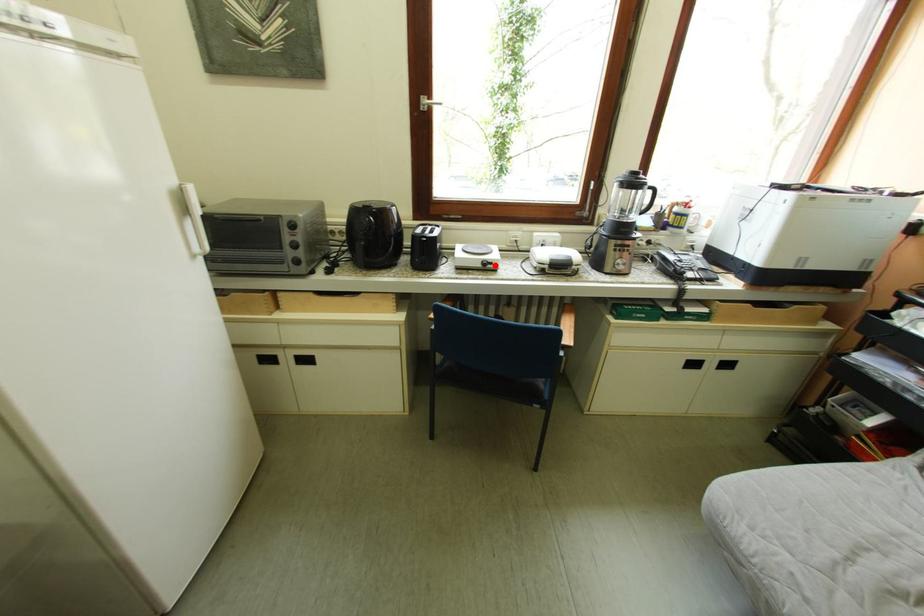
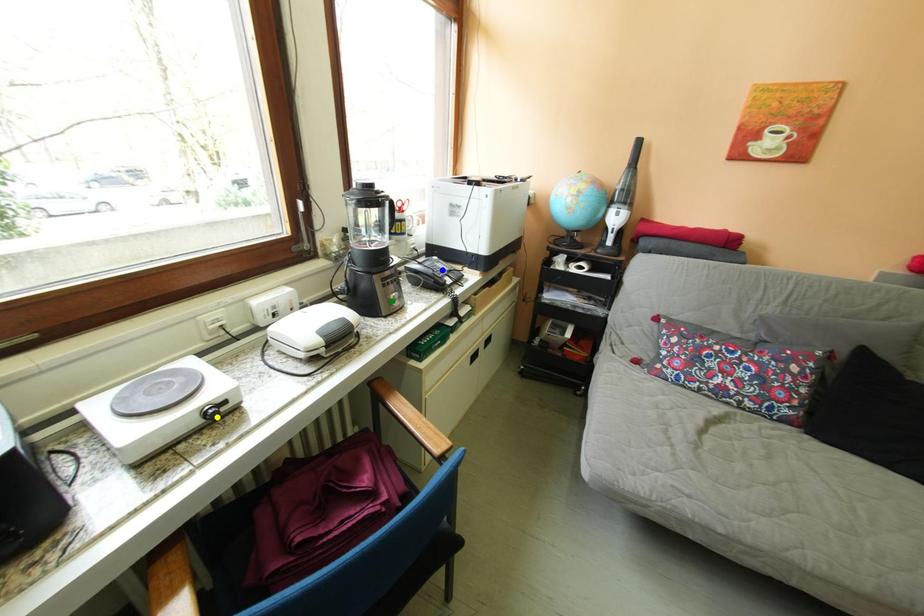
Question: I am providing you with two images of the same scene from different viewpoints. A red point is marked on the first image. You are given multiple points on the second image. Which spot in image 2 lines up with the point in image 1?

Choices:
 (A) green point
 (B) yellow point
 (C) blue point

Answer: (B)